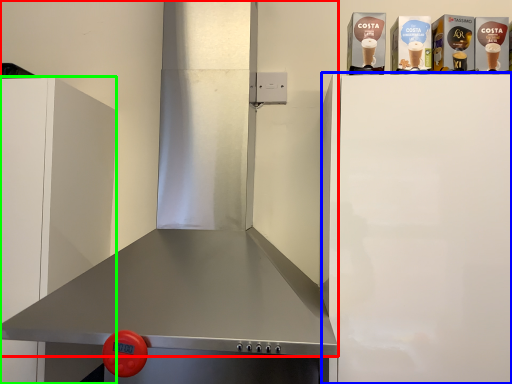
Question: Estimate the real-world distances between objects in this image. Which object is farther from exhaust hood (highlighted by a red box), appliance (highlighted by a blue box) or cabinetry (highlighted by a green box)?

Choices:
 (A) appliance
 (B) cabinetry

Answer: (B)